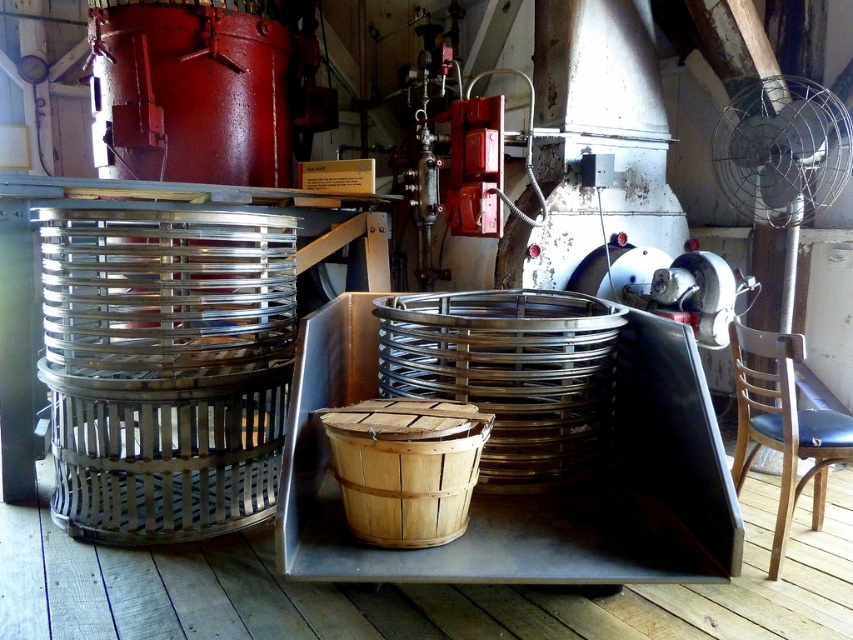
Which is more to the left, metallic wire basket at center or metallic wire mesh fan at upper right?

From the viewer's perspective, metallic wire basket at center appears more on the left side.

Measure the distance from metallic wire basket at center to metallic wire mesh fan at upper right.

They are 1.70 meters apart.

Between point (548, 362) and point (743, 138), which one is positioned behind?

The point (743, 138) is more distant.

What are the coordinates of `metallic wire basket at center` in the screenshot? It's located at (511, 376).

Which is more to the right, metallic wire basket at center or natural wood basket at center?

metallic wire basket at center

Which is below, metallic wire basket at center or natural wood basket at center?

natural wood basket at center is lower down.

Find the location of a particular element. Image resolution: width=853 pixels, height=640 pixels. metallic wire basket at center is located at coordinates (511, 376).

Does natural wood basket at center lie in front of metallic wire mesh fan at upper right?

Yes, it is in front of metallic wire mesh fan at upper right.

Is natural wood basket at center to the left of metallic wire mesh fan at upper right from the viewer's perspective?

Indeed, natural wood basket at center is positioned on the left side of metallic wire mesh fan at upper right.

This screenshot has height=640, width=853. Describe the element at coordinates (405, 467) in the screenshot. I see `natural wood basket at center` at that location.

Locate an element on the screen. natural wood basket at center is located at coordinates (405, 467).